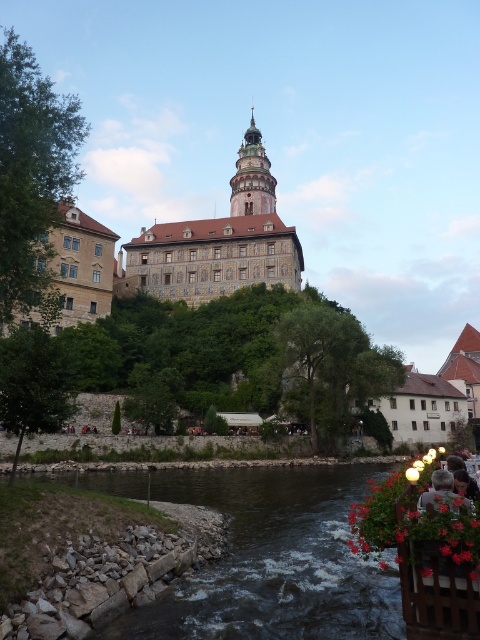
Is stone mosaic building at center to the left of dark brown stone tower at center from the viewer's perspective?

Yes, stone mosaic building at center is to the left of dark brown stone tower at center.

Between stone mosaic building at center and dark brown stone tower at center, which one has more height?

With more height is stone mosaic building at center.

Identify the location of stone mosaic building at center. Image resolution: width=480 pixels, height=640 pixels. click(x=217, y=243).

Where is `stone mosaic building at center`? The image size is (480, 640). stone mosaic building at center is located at coordinates (217, 243).

Can you confirm if dark brown stone river at lower center is positioned above stone mosaic building at center?

Incorrect, dark brown stone river at lower center is not positioned above stone mosaic building at center.

Who is more distant from viewer, (233, 568) or (170, 257)?

The point (170, 257) is behind.

Where is `dark brown stone river at lower center`? Image resolution: width=480 pixels, height=640 pixels. dark brown stone river at lower center is located at coordinates (274, 561).

Can you confirm if dark brown stone river at lower center is thinner than dark brown stone tower at center?

No.

Can you confirm if dark brown stone river at lower center is wider than dark brown stone tower at center?

Yes, dark brown stone river at lower center is wider than dark brown stone tower at center.

Does point (200, 624) come closer to viewer compared to point (254, 129)?

Yes, point (200, 624) is closer to viewer.

The image size is (480, 640). In order to click on dark brown stone river at lower center in this screenshot , I will do `click(274, 561)`.